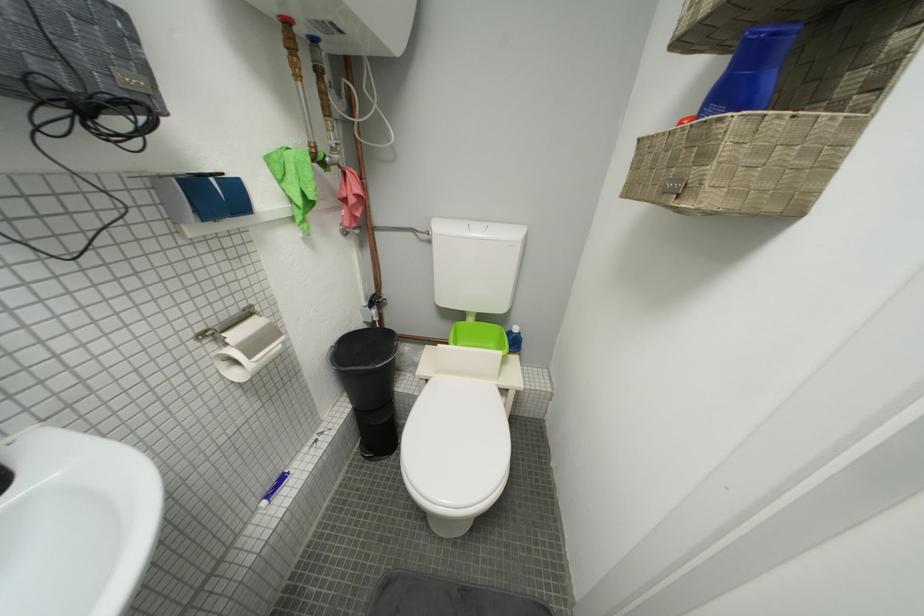
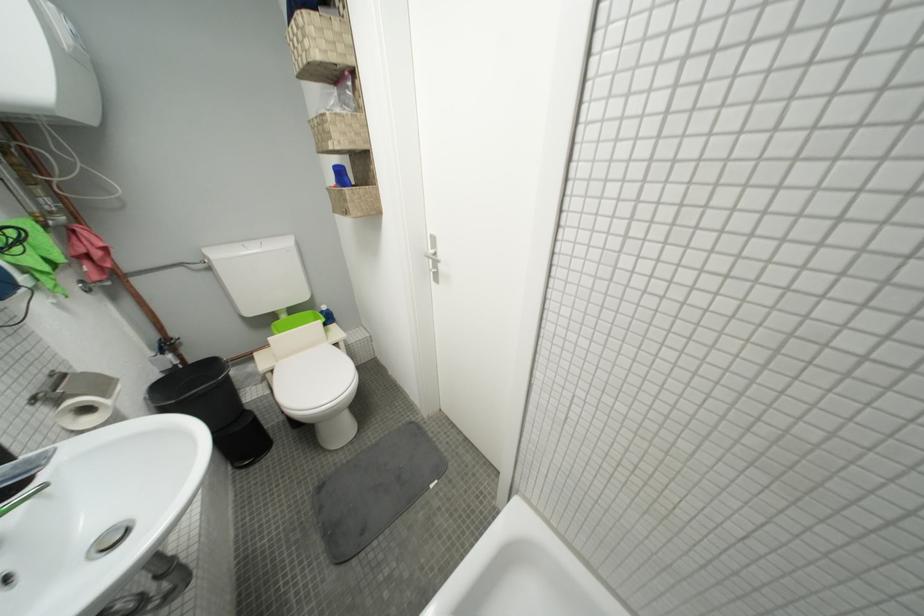
The point at (x=385, y=302) is marked in the first image. Where is the corresponding point in the second image?

(175, 347)